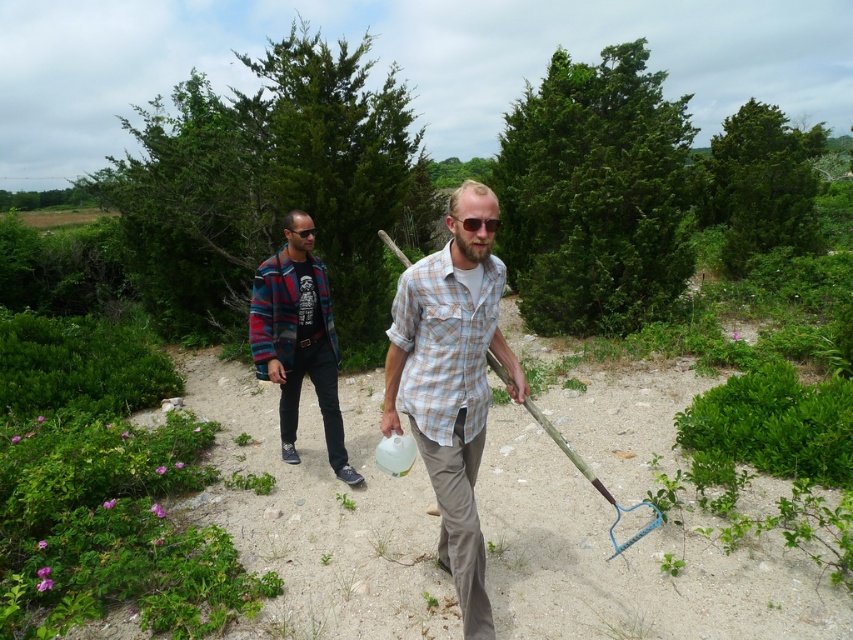
You are standing at the origin point of the image. Which object is closer to you, the plaid cotton shirt at center or the person on the right?

The plaid cotton shirt at center is located at point (451, 381), which is closer to the origin than the person on the right, so the plaid cotton shirt at center is closer to you.

You are a photographer trying to capture both the plaid cotton shirt at center and the plaid wool jacket at left in the same frame. Based on their positions, which one is closer to the camera?

The plaid cotton shirt at center is in front of the plaid wool jacket at left, so it is closer to the camera.

You are a photographer trying to capture the two people in the scene. You notice the plaid cotton shirt at center and the plaid wool jacket at left. Which clothing item is positioned lower in the image?

The plaid cotton shirt at center is located below the plaid wool jacket at left, so it is positioned lower in the image.